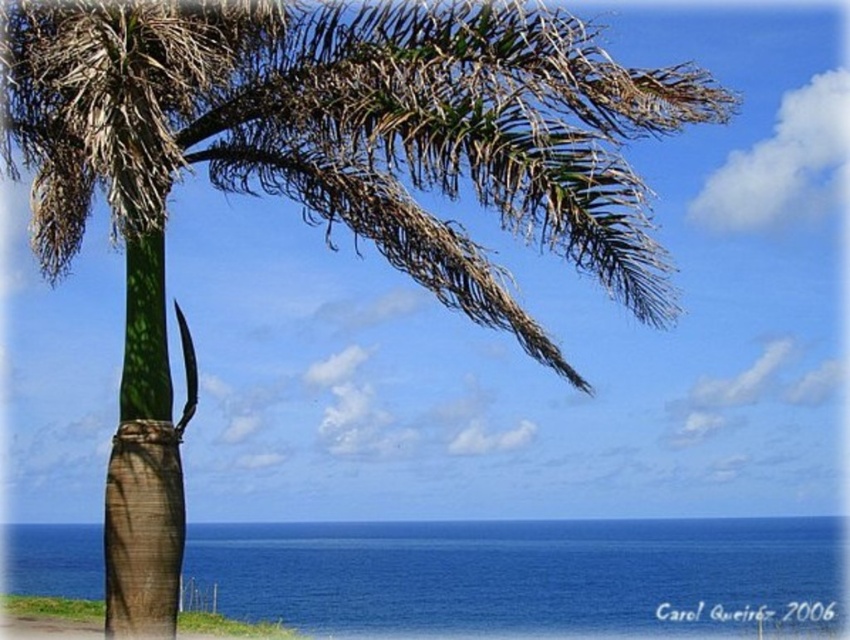
You are standing at the edge of the beach and want to walk to the ocean. Which area between the blue liquid water at lower center and the smooth sand at lower left is wider for you to step on?

The blue liquid water at lower center is wider than the smooth sand at lower left, so you should step on the blue liquid water at lower center because it has a larger width.

You are standing at the center of the image and want to pour a cup of water. Where is the blue liquid water at lower center located in relation to your current position?

The blue liquid water at lower center is located at point 0.900 in the x coordinate and 0.621 in the y coordinate.